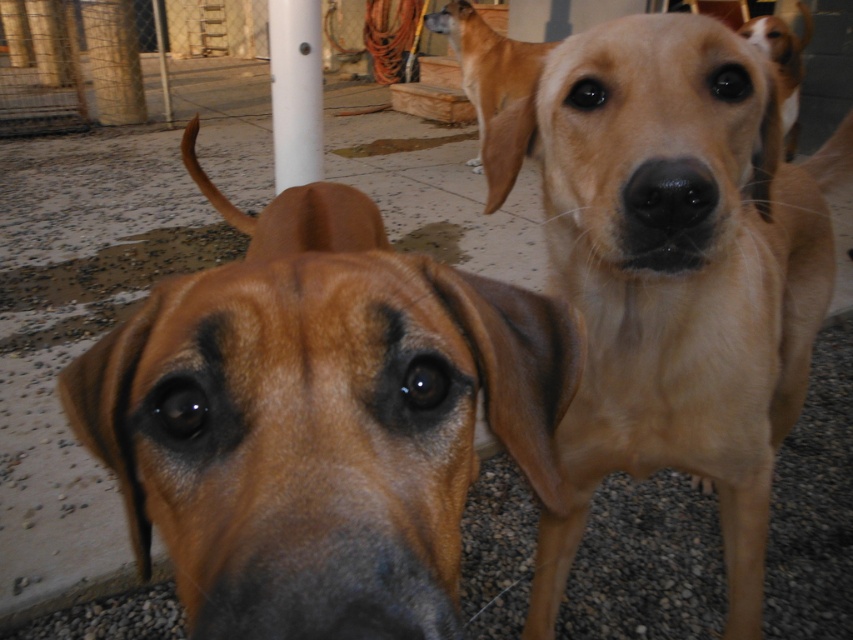
Question: Can you confirm if light brown fur at center is positioned to the left of light brown fur at upper center?

Choices:
 (A) yes
 (B) no

Answer: (A)

Question: Does light brown fur at upper center have a smaller size compared to white smooth pole at center?

Choices:
 (A) no
 (B) yes

Answer: (B)

Question: Based on their relative distances, which object is nearer to the white smooth pole at center?

Choices:
 (A) light brown fur at upper center
 (B) black smooth nose at center
 (C) light brown fur at center

Answer: (A)

Question: Which point is closer to the camera?

Choices:
 (A) black smooth nose at center
 (B) light brown fur at center

Answer: (A)

Question: Estimate the real-world distances between objects in this image. Which object is farther from the light brown fur at center?

Choices:
 (A) light brown fur at upper center
 (B) black smooth nose at center
 (C) brown matte dog at center
 (D) white smooth pole at center

Answer: (A)

Question: Is brown matte dog at center in front of white smooth pole at center?

Choices:
 (A) no
 (B) yes

Answer: (B)